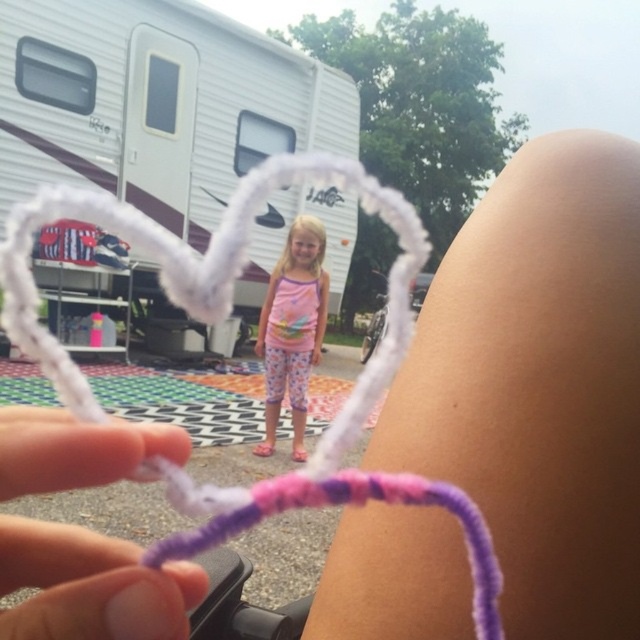
You are a camper who wants to move from the white plastic recreational vehicle at upper left to the white plastic recreational vehicle at center. Can you walk directly between them without any obstacles?

The distance between the white plastic recreational vehicle at upper left and the white plastic recreational vehicle at center is 9.03 feet, so yes, you can walk directly between them without any obstacles.